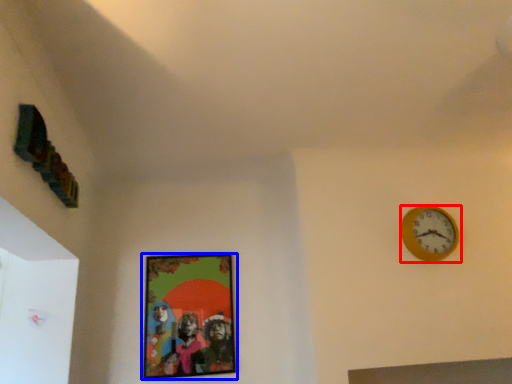
Question: Which object is further to the camera taking this photo, wall clock (highlighted by a red box) or picture frame (highlighted by a blue box)?

Choices:
 (A) wall clock
 (B) picture frame

Answer: (B)